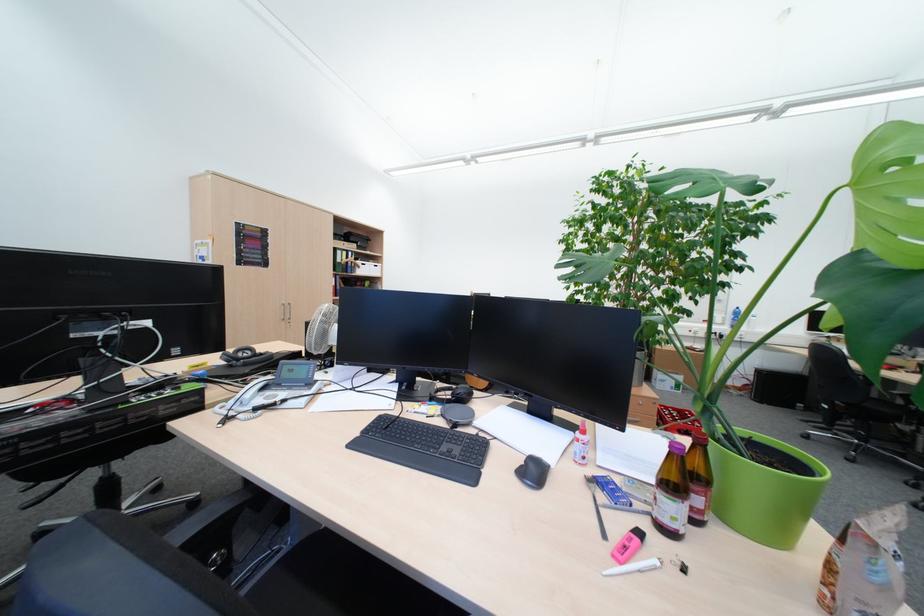
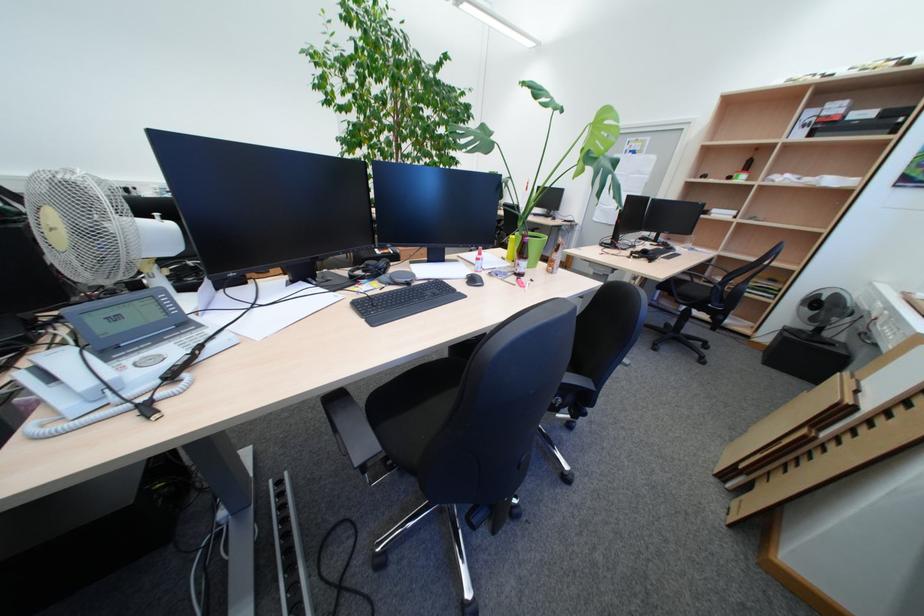
In the second image, find the point that corresponds to the point at 467,426 in the first image.

(419, 285)